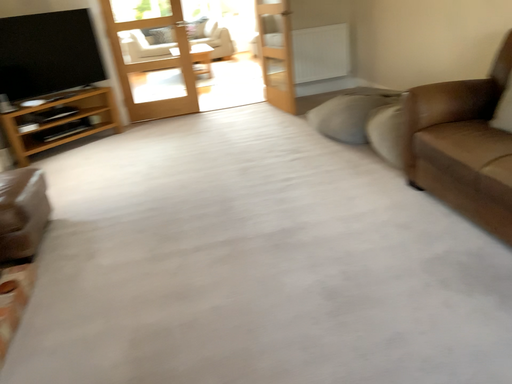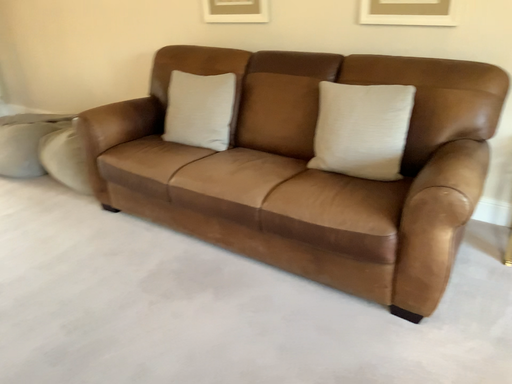
Question: Which way did the camera rotate in the video?

Choices:
 (A) rotated left
 (B) rotated right

Answer: (B)